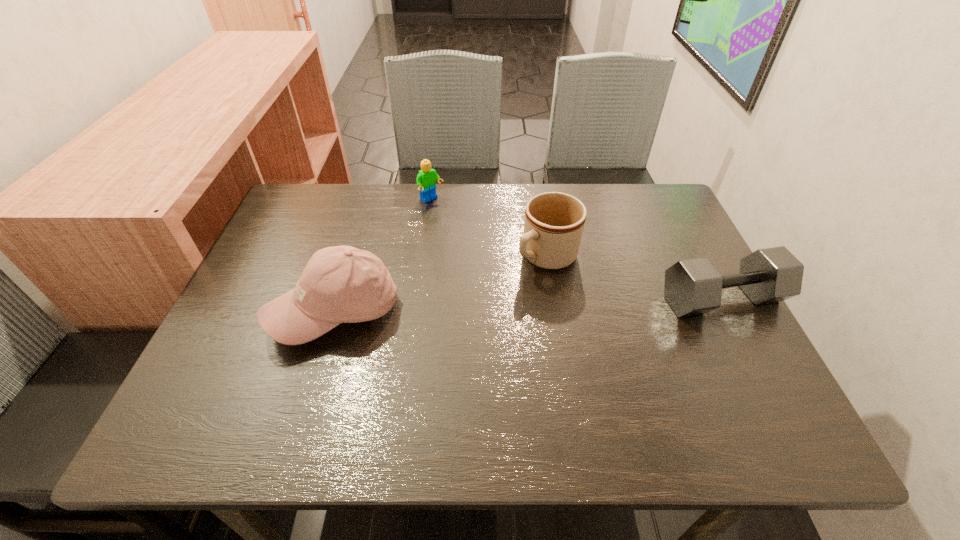
Identify the location of free space on the desktop that is between the leftmost object and the dumbbell and is positioned on the side of the mug with the handle. click(x=473, y=307).

Identify the location of vacant space on the desktop that is between the leftmost object and the rightmost object and is positioned on the face of the Lego. Image resolution: width=960 pixels, height=540 pixels. (551, 305).